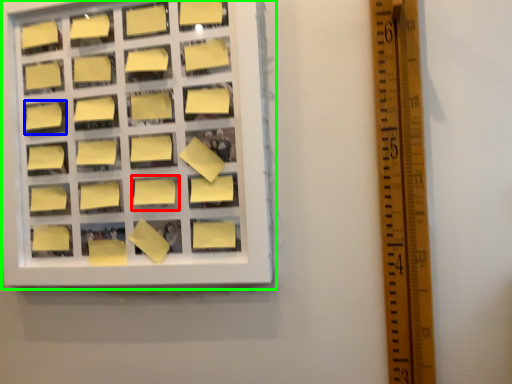
Question: Estimate the real-world distances between objects in this image. Which object is closer to square (highlighted by a red box), square (highlighted by a blue box) or window frame (highlighted by a green box)?

Choices:
 (A) square
 (B) window frame

Answer: (B)